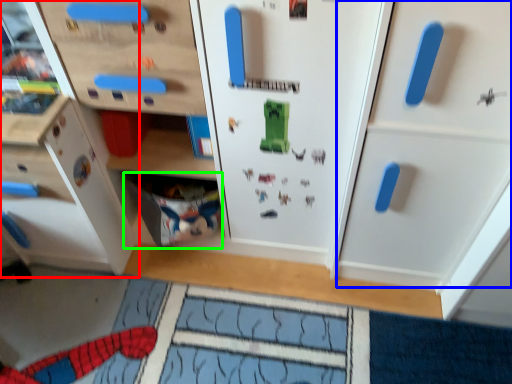
Question: Which is nearer to the cabinetry (highlighted by a red box)? cabinetry (highlighted by a blue box) or drawer (highlighted by a green box).

Choices:
 (A) cabinetry
 (B) drawer

Answer: (B)